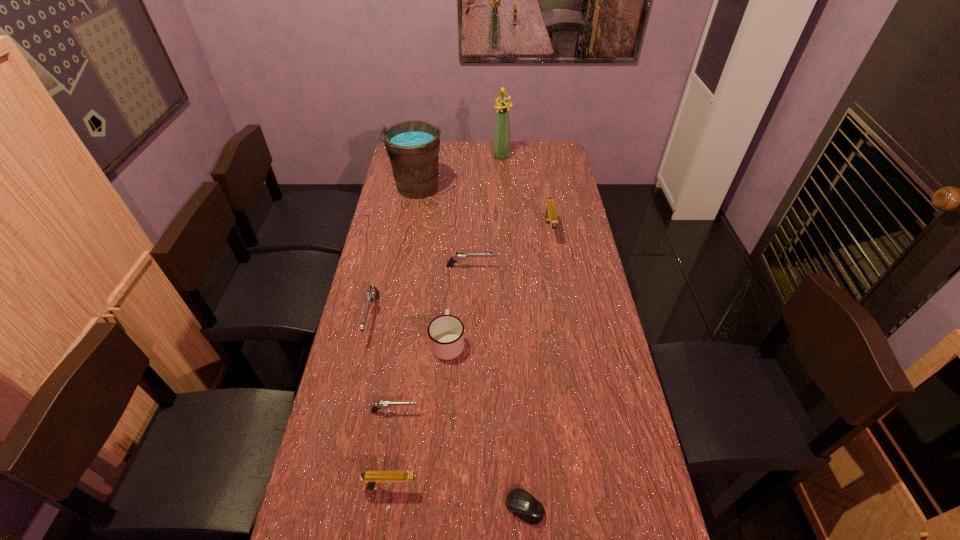
Locate an element on the screen. This screenshot has height=540, width=960. vacant region located on the side of the mug with the handle is located at coordinates (452, 267).

Locate an element on the screen. free location located on the side of the mug with the handle is located at coordinates (450, 301).

This screenshot has height=540, width=960. I want to click on vacant space located 0.250m on the side of the mug with the handle, so click(452, 271).

The width and height of the screenshot is (960, 540). I want to click on vacant space located 0.280m on the front-facing side of the third nearest pistol, so click(348, 430).

Locate an element on the screen. vacant region located 0.360m at the barrel of the nearer tan pistol is located at coordinates (562, 488).

Find the location of `free spot located 0.300m on the front-facing side of the fourth pistol from left to right`. free spot located 0.300m on the front-facing side of the fourth pistol from left to right is located at coordinates (574, 267).

I want to click on vacant point located on the front-facing side of the second nearest pistol, so click(479, 411).

Where is `vacant space positioned on the back of the shortest object`? This screenshot has width=960, height=540. vacant space positioned on the back of the shortest object is located at coordinates (518, 416).

Where is `object at the far edge`? The width and height of the screenshot is (960, 540). object at the far edge is located at coordinates (501, 142).

Image resolution: width=960 pixels, height=540 pixels. Identify the location of wine bucket positioned at the left edge. (413, 147).